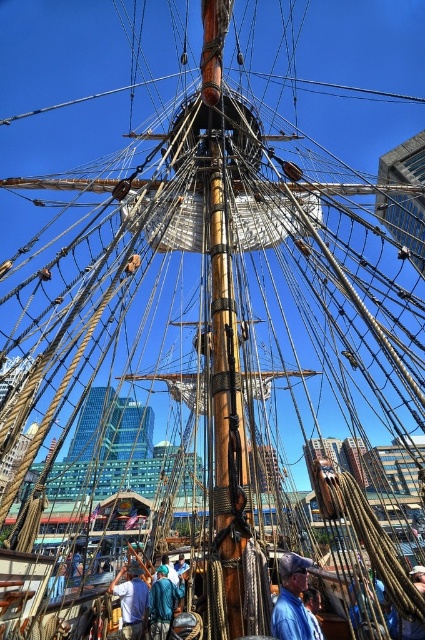
Question: Observing the image, what is the correct spatial positioning of white cotton shirt at center in reference to blue fabric shirt at center?

Choices:
 (A) below
 (B) above

Answer: (A)

Question: Which point is closer to the camera?

Choices:
 (A) blue fabric shirt at center
 (B) blue denim shirt at center
 (C) white cotton shirt at center

Answer: (B)

Question: Is white cotton shirt at center behind blue fabric shirt at center?

Choices:
 (A) no
 (B) yes

Answer: (B)

Question: Does blue denim shirt at center have a smaller size compared to blue fabric shirt at center?

Choices:
 (A) no
 (B) yes

Answer: (A)

Question: Which is farther from the white cotton shirt at center?

Choices:
 (A) blue denim shirt at center
 (B) blue fabric shirt at center

Answer: (A)

Question: Among these objects, which one is farthest from the camera?

Choices:
 (A) white cotton shirt at center
 (B) blue fabric shirt at center
 (C) blue denim shirt at center

Answer: (A)